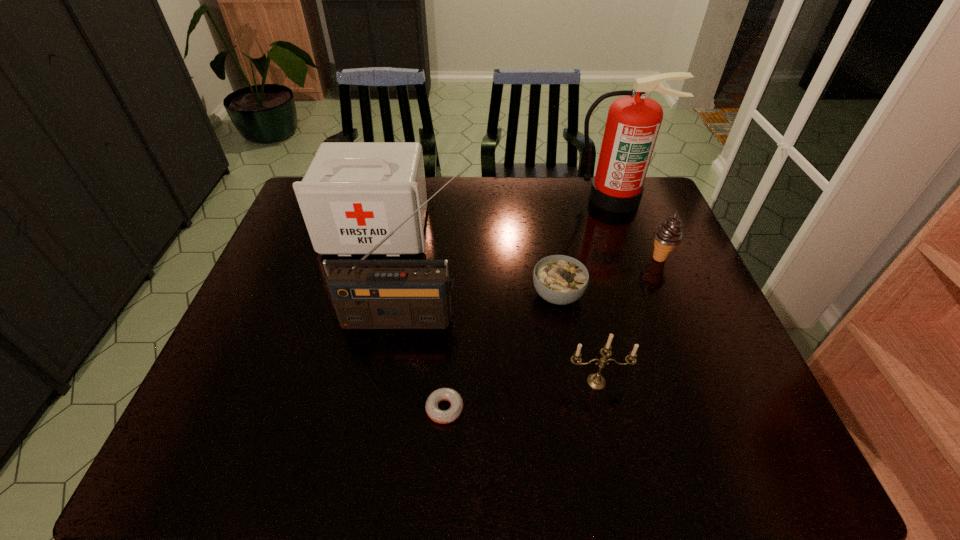
The image size is (960, 540). In order to click on vacant region located on the front-facing side of the fifth shortest object in this screenshot , I will do `click(357, 305)`.

Where is `vacant area situated on the left of the candle`? Image resolution: width=960 pixels, height=540 pixels. vacant area situated on the left of the candle is located at coordinates (512, 382).

The image size is (960, 540). I want to click on free region located on the front of the icecream, so click(x=706, y=366).

The image size is (960, 540). Identify the location of vacant area located 0.140m on the front of the sixth tallest object. (569, 360).

The height and width of the screenshot is (540, 960). What are the coordinates of `free location located 0.230m on the left of the doughnut` in the screenshot? It's located at (319, 409).

At what (x,y) coordinates should I click in order to perform the action: click on fire extinguisher that is at the far edge. Please return your answer as a coordinate pair (x, y). This screenshot has height=540, width=960. Looking at the image, I should click on (633, 122).

The height and width of the screenshot is (540, 960). What are the coordinates of `the first-aid kit at the far edge` in the screenshot? It's located at (353, 194).

Locate an element on the screen. The height and width of the screenshot is (540, 960). object located in the left edge section of the desktop is located at coordinates (353, 194).

Find the location of a particular element. The image size is (960, 540). fire extinguisher that is at the right edge is located at coordinates (633, 122).

Identify the location of icecream at the right edge. This screenshot has width=960, height=540. (668, 234).